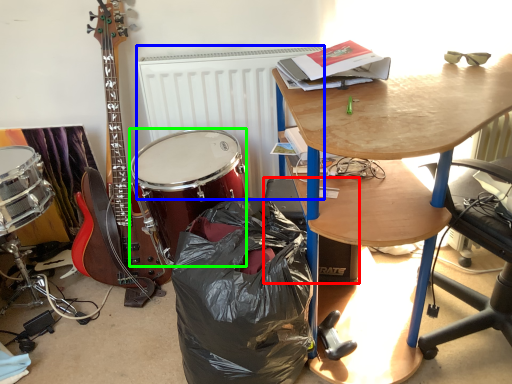
Question: Based on their relative distances, which object is nearer to loudspeaker (highlighted by a red box)? Choose from radiator (highlighted by a blue box) and drum (highlighted by a green box).

Choices:
 (A) radiator
 (B) drum

Answer: (B)